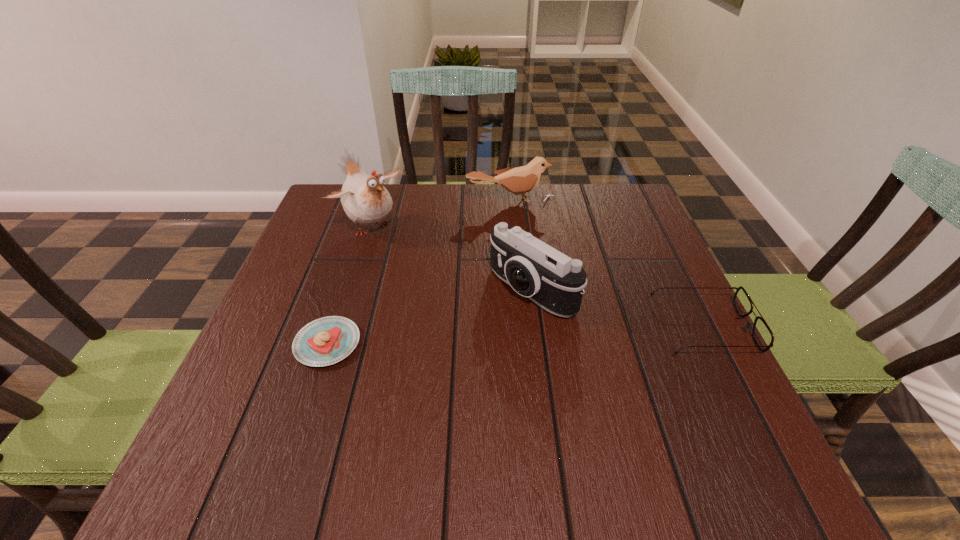
Find the location of `the shortest object`. the shortest object is located at coordinates (325, 341).

Identify the location of the second shortest object. The width and height of the screenshot is (960, 540). (763, 337).

Where is `sunglasses`? Image resolution: width=960 pixels, height=540 pixels. sunglasses is located at coordinates (763, 337).

At what (x,y) coordinates should I click in order to perform the action: click on the tallest object. Please return your answer as a coordinate pair (x, y). The width and height of the screenshot is (960, 540). Looking at the image, I should click on (365, 200).

At what (x,y) coordinates should I click in order to perform the action: click on the left bird. Please return your answer as a coordinate pair (x, y). The height and width of the screenshot is (540, 960). Looking at the image, I should click on (365, 200).

Identify the location of camera. This screenshot has height=540, width=960. (533, 269).

Locate an element on the screen. the third shortest object is located at coordinates (519, 180).

You are a GUI agent. You are given a task and a screenshot of the screen. Output one action in this format:
    pyautogui.click(x=<x>, y=<y>)
    Task: Click on the right bird
    The height and width of the screenshot is (540, 960).
    Given the screenshot: What is the action you would take?
    pyautogui.click(x=519, y=180)

Where is `vacant space located on the front of the pastry`? The image size is (960, 540). vacant space located on the front of the pastry is located at coordinates (309, 399).

Locate an element on the screen. free space located 0.350m at the beak of the tallest object is located at coordinates (478, 321).